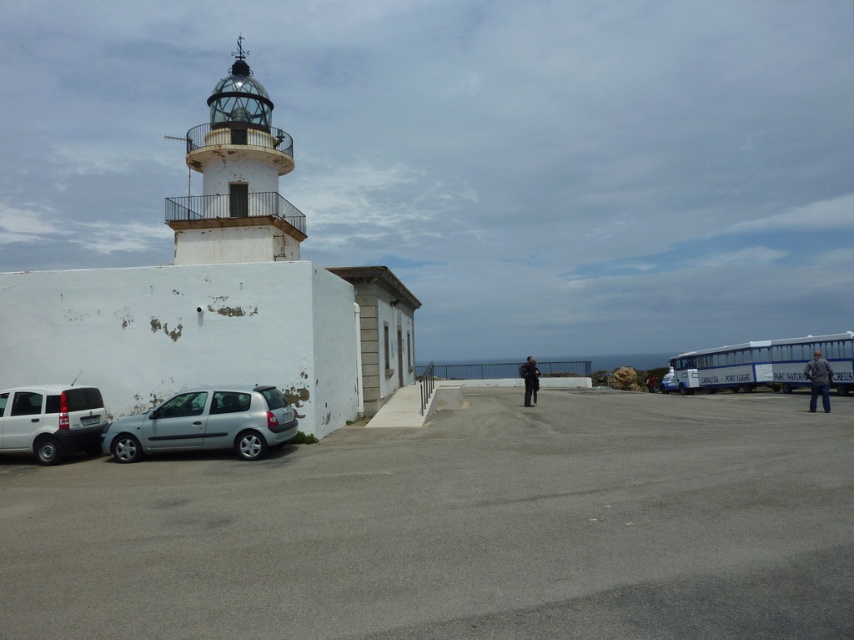
Between point (665, 385) and point (653, 378), which one is positioned behind?

The point (653, 378) is more distant.

Who is more forward, (673, 378) or (648, 376)?

Positioned in front is point (673, 378).

Which is in front, point (674, 390) or point (654, 392)?

Point (674, 390) is in front.

This screenshot has width=854, height=640. Identify the location of silver metallic car at center. (668, 381).

Is point (667, 577) closer to viewer compared to point (56, 403)?

Yes.

Which is behind, point (147, 624) or point (98, 449)?

The point (98, 449) is more distant.

Is point (167, 579) positioned behind point (88, 401)?

That is False.

Where is `gray asphalt parking lot at center`? This screenshot has width=854, height=640. gray asphalt parking lot at center is located at coordinates (455, 529).

Is white matte suv at lower left smaller than black fabric jacket at center?

Correct, white matte suv at lower left occupies less space than black fabric jacket at center.

Consider the image. Who is taller, white matte suv at lower left or black fabric jacket at center?

black fabric jacket at center

This screenshot has height=640, width=854. What do you see at coordinates (50, 420) in the screenshot? I see `white matte suv at lower left` at bounding box center [50, 420].

You are a GUI agent. You are given a task and a screenshot of the screen. Output one action in this format:
    pyautogui.click(x=<x>, y=<y>)
    Task: Click on the white matte suv at lower left
    This screenshot has width=854, height=640.
    Given the screenshot: What is the action you would take?
    pyautogui.click(x=50, y=420)